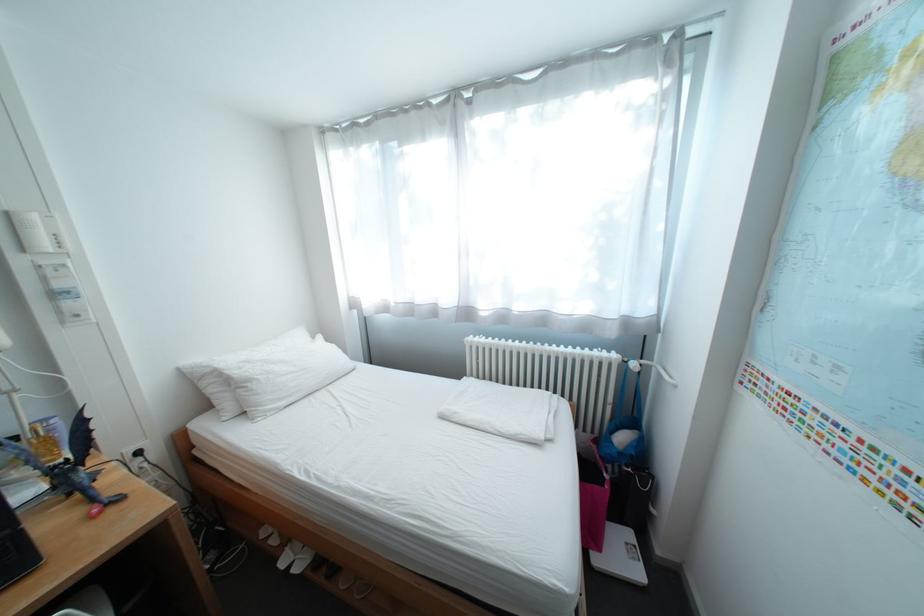
This screenshot has width=924, height=616. Find the location of `white slipper`. white slipper is located at coordinates (295, 557).